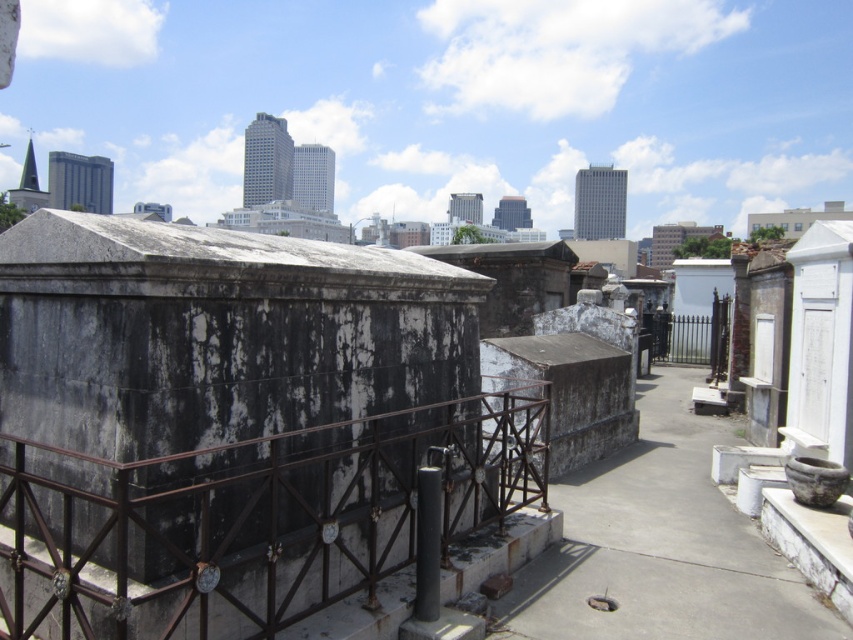
Question: Which point is farther to the camera?

Choices:
 (A) (677, 522)
 (B) (387, 500)

Answer: (A)

Question: Is rusty metal railing at center wider than gray concrete pavement at center?

Choices:
 (A) yes
 (B) no

Answer: (B)

Question: Which point is closer to the camera?

Choices:
 (A) gray concrete pavement at center
 (B) rusty metal railing at center

Answer: (B)

Question: Can you confirm if rusty metal railing at center is positioned below gray concrete pavement at center?

Choices:
 (A) yes
 (B) no

Answer: (B)

Question: Does rusty metal railing at center appear over gray concrete pavement at center?

Choices:
 (A) no
 (B) yes

Answer: (B)

Question: Which point is closer to the camera?

Choices:
 (A) (699, 524)
 (B) (280, 621)

Answer: (B)